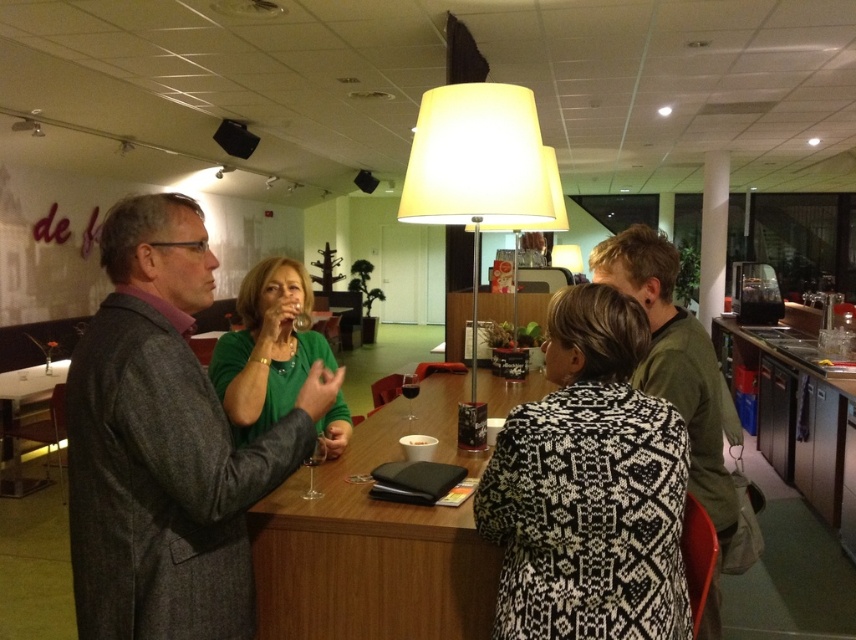
You are standing at the entrance of the room and want to hang a new picture frame between the white fabric lampshade at upper center and the green matte shirt at center. Based on their positions, where should the picture frame be placed?

The picture frame should be placed between the white fabric lampshade at upper center and the green matte shirt at center since the lampshade is above the shirt.